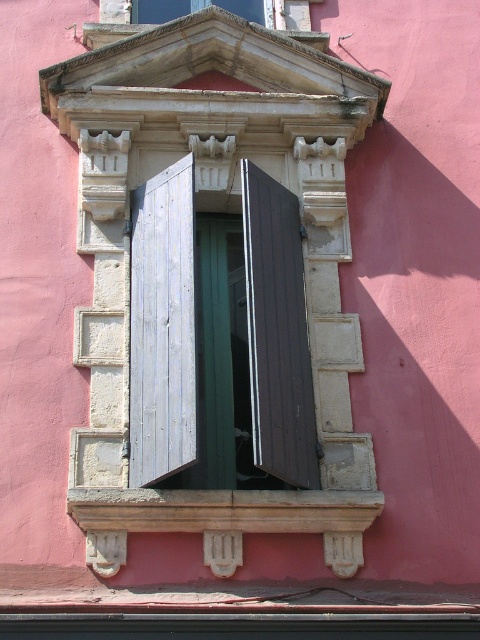
You are an architect designing a model of this building. You have two wooden shutters at upper center and a brown wooden shutter at center. Which of these shutters has a greater width?

The brown wooden shutter at center has a greater width than the wooden shutters at upper center.

You are standing in front of the building and want to locate the light gray wood shutter at left. What are the coordinates of its position?

The light gray wood shutter at left is located at coordinates point (x=163, y=326).

You are an architect inspecting the building facade. You notice the light gray wood shutter at left and the brown wooden shutter at center. Which shutter has a smaller height?

The light gray wood shutter at left has a lesser height compared to the brown wooden shutter at center, so the light gray wood shutter at left is smaller in height.